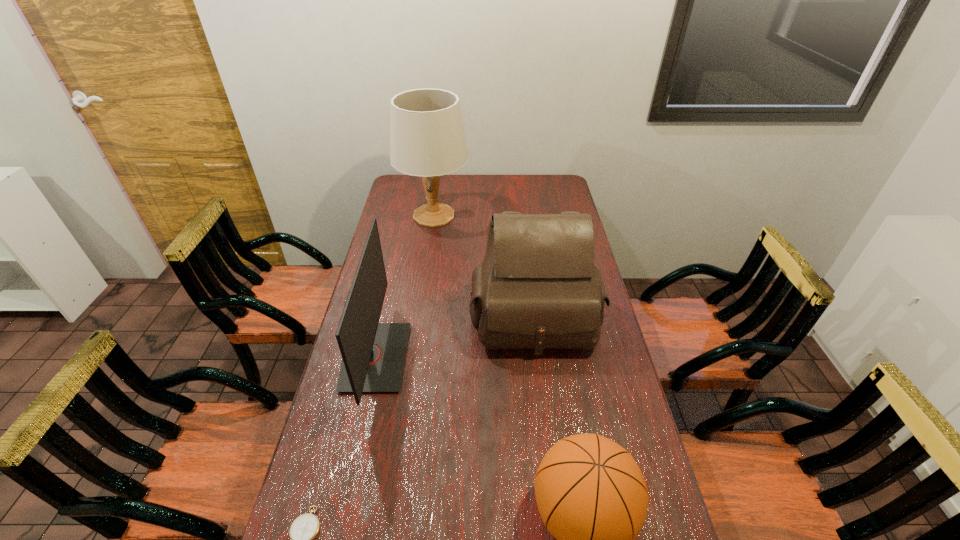
Identify the location of the tallest object. (427, 138).

I want to click on table lamp, so click(427, 138).

You are a GUI agent. You are given a task and a screenshot of the screen. Output one action in this format:
    pyautogui.click(x=<x>, y=<y>)
    Task: Click on the satchel
    
    Given the screenshot: What is the action you would take?
    pyautogui.click(x=537, y=287)

At what (x,y) coordinates should I click in order to perform the action: click on monitor. Please return your answer as a coordinate pair (x, y). This screenshot has width=960, height=540. Looking at the image, I should click on coord(373,354).

Identify the location of blank area located 0.310m on the front of the table lamp. The height and width of the screenshot is (540, 960). (424, 284).

The width and height of the screenshot is (960, 540). What are the coordinates of `vacant point located on the front flap of the satchel` in the screenshot? It's located at (541, 377).

Locate an element on the screen. The height and width of the screenshot is (540, 960). vacant point located 0.240m on the screen side of the monitor is located at coordinates (480, 357).

Locate an element on the screen. Image resolution: width=960 pixels, height=540 pixels. object that is at the far edge is located at coordinates (427, 138).

Where is `table lamp that is positioned at the left edge`? The width and height of the screenshot is (960, 540). table lamp that is positioned at the left edge is located at coordinates (427, 138).

Locate an element on the screen. This screenshot has height=540, width=960. monitor that is positioned at the left edge is located at coordinates (373, 354).